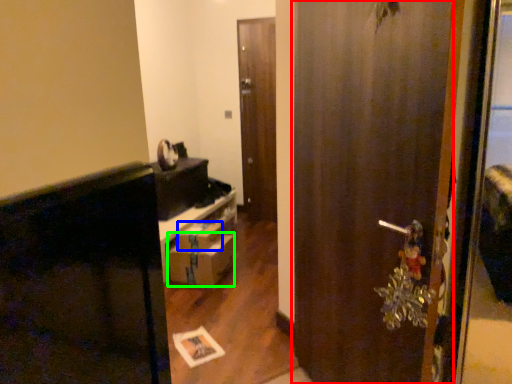
Question: Which is nearer to the door (highlighted by a red box)? box (highlighted by a blue box) or drawer (highlighted by a green box).

Choices:
 (A) box
 (B) drawer

Answer: (B)